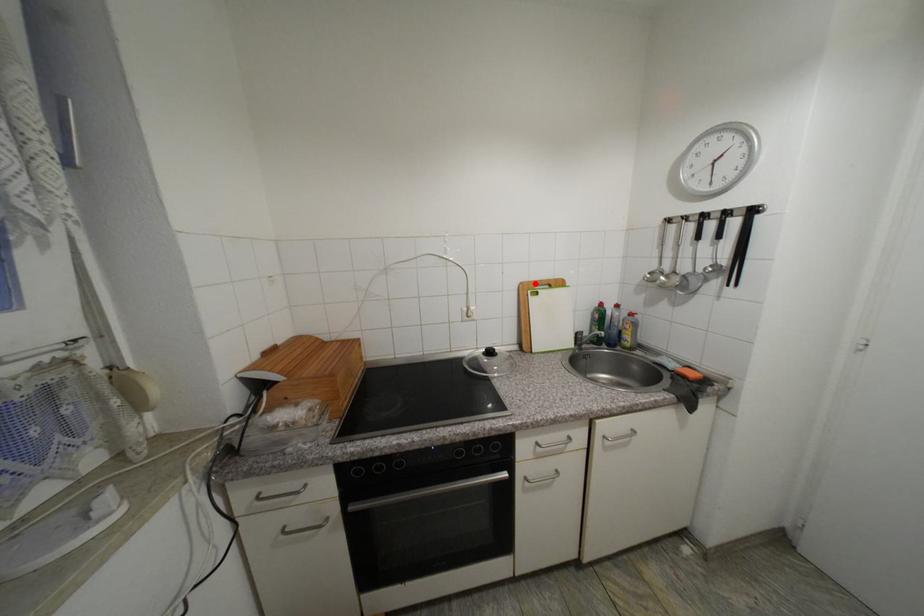
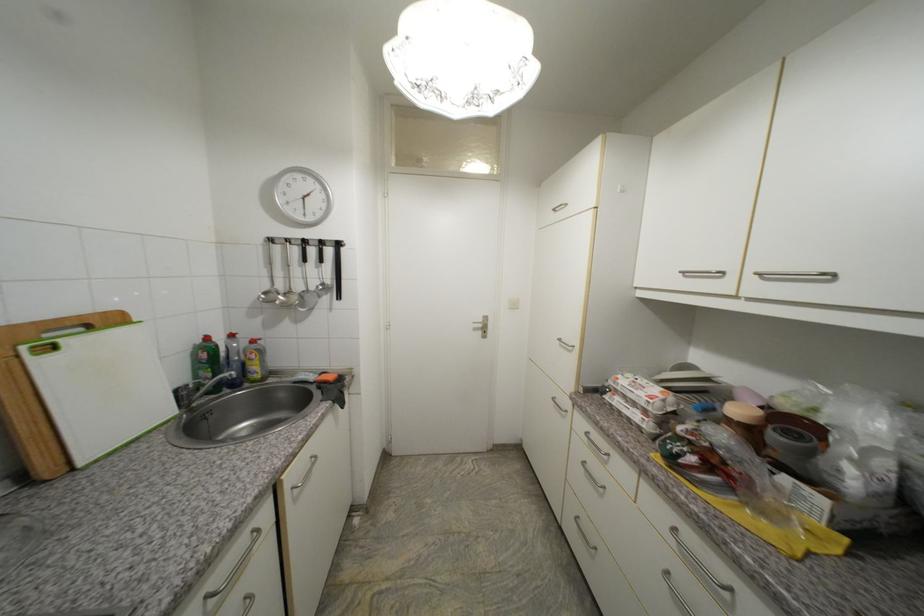
Locate, in the second image, the point that corresponds to the highlighted location in the first image.

(19, 328)